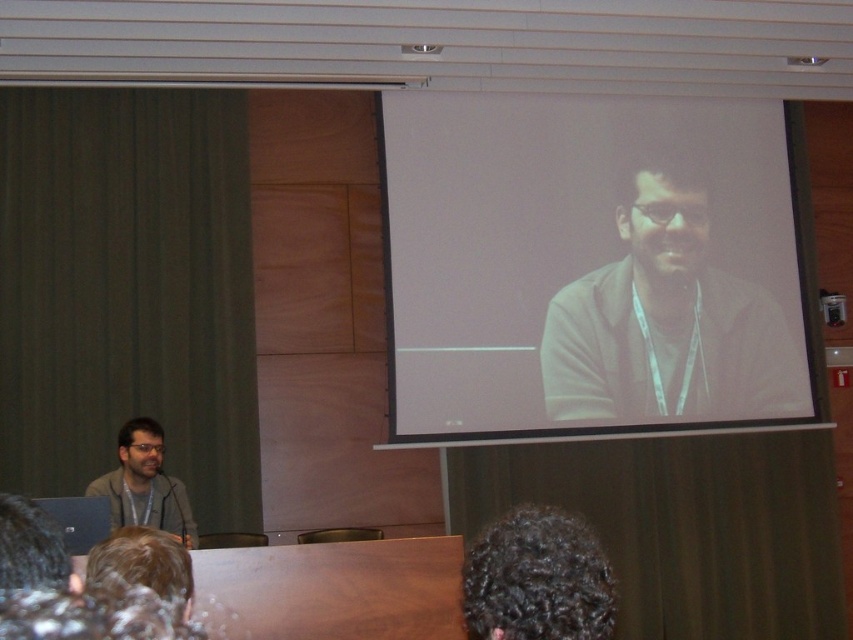
You are a participant in the conference and want to locate the white matte screen at upper center. According to the coordinates provided, where should you look on the screen?

The white matte screen at upper center is located at coordinates point (595, 268).